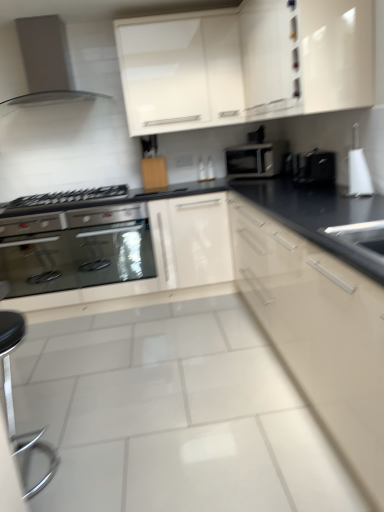
Describe the element at coordinates (12, 398) in the screenshot. I see `polished chrome bar stool at lower left` at that location.

Image resolution: width=384 pixels, height=512 pixels. Describe the element at coordinates (36, 56) in the screenshot. I see `satin metallic range hood at upper left` at that location.

The width and height of the screenshot is (384, 512). What do you see at coordinates (77, 250) in the screenshot?
I see `stainless steel oven at lower left` at bounding box center [77, 250].

What is the approximate width of white glossy kettle at upper right, which is counted as the second appliance, starting from the back?

The width of white glossy kettle at upper right, which is counted as the second appliance, starting from the back, is 6.48 inches.

You are a GUI agent. You are given a task and a screenshot of the screen. Output one action in this format:
    pyautogui.click(x=<x>, y=<y>)
    Task: Click on the white glossy cabinet at upper center, which is counted as the second cabinetry, starting from the left
    The image size is (384, 512).
    Given the screenshot: What is the action you would take?
    pyautogui.click(x=180, y=71)

The image size is (384, 512). I want to click on black glass gas stove at left, so click(67, 197).

From a real-world perspective, relative to stainless steel oven at lower left, is polished chrome bar stool at lower left vertically above or below?

polished chrome bar stool at lower left is below stainless steel oven at lower left.

Is the position of polished chrome bar stool at lower left less distant than that of stainless steel oven at lower left?

Yes, polished chrome bar stool at lower left is in front of stainless steel oven at lower left.

Is polished chrome bar stool at lower left oriented away from stainless steel oven at lower left?

Yes.

In terms of size, does polished chrome bar stool at lower left appear bigger or smaller than stainless steel oven at lower left?

In the image, polished chrome bar stool at lower left appears to be smaller than stainless steel oven at lower left.

Are white glossy cabinet at upper center, which is the 3th cabinetry in left-to-right order, and stainless steel oven at lower left making contact?

No, white glossy cabinet at upper center, which is the 3th cabinetry in left-to-right order, is not making contact with stainless steel oven at lower left.

Identify the location of oven lying behind the white glossy cabinet at upper center, which is the 3th cabinetry in left-to-right order. This screenshot has width=384, height=512. (77, 250).

Can you confirm if white glossy cabinet at upper center, acting as the first cabinetry starting from the right, is taller than stainless steel oven at lower left?

Yes, white glossy cabinet at upper center, acting as the first cabinetry starting from the right, is taller than stainless steel oven at lower left.

Considering the relative positions of white glossy cabinet at upper center, acting as the first cabinetry starting from the right, and stainless steel oven at lower left in the image provided, is white glossy cabinet at upper center, acting as the first cabinetry starting from the right, behind stainless steel oven at lower left?

No, it is not.

Where is `kitchen appliance on the right side of stainless steel oven at lower left`? The width and height of the screenshot is (384, 512). kitchen appliance on the right side of stainless steel oven at lower left is located at coordinates (256, 159).

Could you tell me if satin silver toaster at center is facing stainless steel oven at lower left?

No, satin silver toaster at center is not facing towards stainless steel oven at lower left.

Which object is thinner, satin silver toaster at center or stainless steel oven at lower left?

Thinner between the two is satin silver toaster at center.

From the image's perspective, which one is positioned lower, satin silver toaster at center or stainless steel oven at lower left?

From the image's view, stainless steel oven at lower left is below.

Is satin metallic range hood at upper left aimed at white glossy cabinet at upper center, acting as the first cabinetry starting from the right?

No, satin metallic range hood at upper left is not oriented towards white glossy cabinet at upper center, acting as the first cabinetry starting from the right.

Is satin metallic range hood at upper left not close to white glossy cabinet at upper center, which is the 3th cabinetry in left-to-right order?

satin metallic range hood at upper left is actually quite close to white glossy cabinet at upper center, which is the 3th cabinetry in left-to-right order.

Which object is closer to the camera, satin metallic range hood at upper left or white glossy cabinet at upper center, which is the 3th cabinetry in left-to-right order?

white glossy cabinet at upper center, which is the 3th cabinetry in left-to-right order.

What are the coordinates of `home appliance behind the white glossy cabinet at upper center, acting as the first cabinetry starting from the right` in the screenshot? It's located at (36, 56).

From the image's perspective, between white glossy cabinet at upper center, which is counted as the second cabinetry, starting from the left, and polished chrome bar stool at lower left, who is located below?

polished chrome bar stool at lower left appears lower in the image.

Is white glossy cabinet at upper center, which is counted as the second cabinetry, starting from the left, oriented towards polished chrome bar stool at lower left?

No.

Where is `bar stool below the white glossy cabinet at upper center, the 2th cabinetry viewed from the right (from a real-world perspective)`? The image size is (384, 512). bar stool below the white glossy cabinet at upper center, the 2th cabinetry viewed from the right (from a real-world perspective) is located at coordinates (12, 398).

Does white glossy cabinet at upper center, the 2th cabinetry viewed from the right, lie in front of polished chrome bar stool at lower left?

No, it is not.

Is the depth of stainless steel oven at lower left less than that of wooden cutting board at center, the first cabinetry viewed from the left?

Yes, it is in front of wooden cutting board at center, the first cabinetry viewed from the left.

Where is `oven in front of the wooden cutting board at center, marked as the third cabinetry in a right-to-left arrangement`? This screenshot has height=512, width=384. oven in front of the wooden cutting board at center, marked as the third cabinetry in a right-to-left arrangement is located at coordinates (77, 250).

Could you measure the distance between stainless steel oven at lower left and wooden cutting board at center, the first cabinetry viewed from the left?

stainless steel oven at lower left is 29.75 inches away from wooden cutting board at center, the first cabinetry viewed from the left.

From the image's perspective, is stainless steel oven at lower left on wooden cutting board at center, the first cabinetry viewed from the left?

No.

Considering the points (365, 191) and (154, 182), which point is behind, point (365, 191) or point (154, 182)?

Positioned behind is point (154, 182).

Considering the sizes of objects white glossy kettle at upper right, the first appliance viewed from the front, and wooden cutting board at center, marked as the third cabinetry in a right-to-left arrangement, in the image provided, who is bigger, white glossy kettle at upper right, the first appliance viewed from the front, or wooden cutting board at center, marked as the third cabinetry in a right-to-left arrangement,?

white glossy kettle at upper right, the first appliance viewed from the front, is bigger.

From a real-world perspective, is white glossy kettle at upper right, which is counted as the second appliance, starting from the back, under wooden cutting board at center, marked as the third cabinetry in a right-to-left arrangement?

Correct, in the physical world, white glossy kettle at upper right, which is counted as the second appliance, starting from the back, is lower than wooden cutting board at center, marked as the third cabinetry in a right-to-left arrangement.

Identify the location of oven located on the left of polished chrome bar stool at lower left. (77, 250).

Find the location of a particular element. This screenshot has width=384, height=512. oven behind the white glossy cabinet at upper center, acting as the first cabinetry starting from the right is located at coordinates (77, 250).

In the scene shown: Based on their spatial positions, is black plastic knife block at center, the 2th appliance viewed from the front, or stainless steel oven at lower left further from satin silver toaster at center?

The object further to satin silver toaster at center is stainless steel oven at lower left.

Looking at this image, based on their spatial positions, is wooden cutting board at center, the first cabinetry viewed from the left, or black glass gas stove at left closer to white glossy cabinet at upper center, which is counted as the second cabinetry, starting from the left?

Among the two, wooden cutting board at center, the first cabinetry viewed from the left, is located nearer to white glossy cabinet at upper center, which is counted as the second cabinetry, starting from the left.

Which object lies nearer to the anchor point white glossy kettle at upper right, which is counted as the second appliance, starting from the back, wooden cutting board at center, the first cabinetry viewed from the left, or white glossy cabinet at upper center, which is counted as the second cabinetry, starting from the left?

Based on the image, white glossy cabinet at upper center, which is counted as the second cabinetry, starting from the left, appears to be nearer to white glossy kettle at upper right, which is counted as the second appliance, starting from the back.

From the image, which object appears to be farther from satin silver toaster at center, white glossy kettle at upper right, which is counted as the second appliance, starting from the back, or black glass gas stove at left?

Based on the image, black glass gas stove at left appears to be further to satin silver toaster at center.

From the image, which object appears to be farther from satin silver toaster at center, black plastic knife block at center, which is the 1th appliance in back-to-front order, or white glossy kettle at upper right, which is counted as the second appliance, starting from the back?

white glossy kettle at upper right, which is counted as the second appliance, starting from the back.

Estimate the real-world distances between objects in this image. Which object is further from satin silver toaster at center, polished chrome bar stool at lower left or satin metallic range hood at upper left?

polished chrome bar stool at lower left lies further to satin silver toaster at center than the other object.

When comparing their distances from polished chrome bar stool at lower left, does black glass gas stove at left or wooden cutting board at center, the first cabinetry viewed from the left, seem further?

wooden cutting board at center, the first cabinetry viewed from the left.

In the scene shown: Based on their spatial positions, is black glass gas stove at left or satin metallic range hood at upper left closer to satin silver toaster at center?

The object closer to satin silver toaster at center is black glass gas stove at left.

At what (x,y) coordinates should I click in order to perform the action: click on appliance between white glossy cabinet at upper center, acting as the first cabinetry starting from the right, and white glossy kettle at upper right, which is counted as the second appliance, starting from the back, vertically. Please return your answer as a coordinate pair (x, y). This screenshot has width=384, height=512. Looking at the image, I should click on (314, 167).

Image resolution: width=384 pixels, height=512 pixels. In order to click on oven between white glossy cabinet at upper center, which is the 3th cabinetry in left-to-right order, and polished chrome bar stool at lower left, in the vertical direction in this screenshot , I will do `click(77, 250)`.

Where is `cabinetry between white glossy kettle at upper right, which is counted as the second appliance, starting from the back, and wooden cutting board at center, the first cabinetry viewed from the left, from front to back`? The height and width of the screenshot is (512, 384). cabinetry between white glossy kettle at upper right, which is counted as the second appliance, starting from the back, and wooden cutting board at center, the first cabinetry viewed from the left, from front to back is located at coordinates (180, 71).

What are the coordinates of `gas stove between stainless steel oven at lower left and black plastic knife block at center, the 2th appliance viewed from the front, from left to right` in the screenshot? It's located at (67, 197).